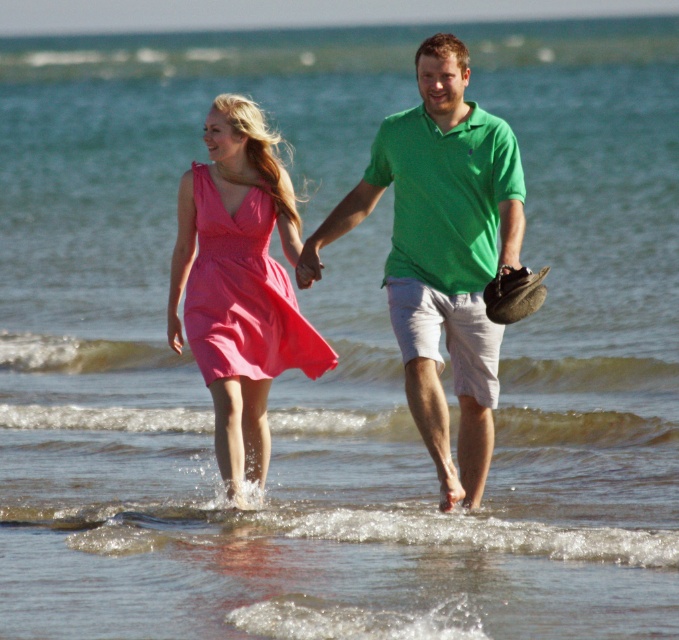
Which of these two, green cotton polo shirt at center or pink satin dress at center, stands taller?

Standing taller between the two is green cotton polo shirt at center.

Is point (504, 156) behind point (242, 403)?

No.

The width and height of the screenshot is (679, 640). Describe the element at coordinates (441, 253) in the screenshot. I see `green cotton polo shirt at center` at that location.

Find the location of a particular element. This screenshot has width=679, height=640. green cotton polo shirt at center is located at coordinates (441, 253).

Who is more distant from viewer, (477, 401) or (225, 304)?

Positioned behind is point (225, 304).

Identify the location of green cotton polo shirt at center. (441, 253).

Is point (490, 237) positioned before point (219, 300)?

Yes, it is.

Locate an element on the screen. The height and width of the screenshot is (640, 679). green cotton polo shirt at center is located at coordinates (441, 253).

Which is above, pink satin dress at center or matte pink fabric dress at center?

matte pink fabric dress at center is above.

You are a GUI agent. You are given a task and a screenshot of the screen. Output one action in this format:
    pyautogui.click(x=<x>, y=<y>)
    Task: Click on the pink satin dress at center
    This screenshot has width=679, height=640.
    Given the screenshot: What is the action you would take?
    pyautogui.click(x=238, y=284)

Is point (172, 275) closer to viewer compared to point (213, 228)?

No, (172, 275) is behind (213, 228).

At what (x,y) coordinates should I click in order to perform the action: click on pink satin dress at center. Please return your answer as a coordinate pair (x, y). Looking at the image, I should click on (238, 284).